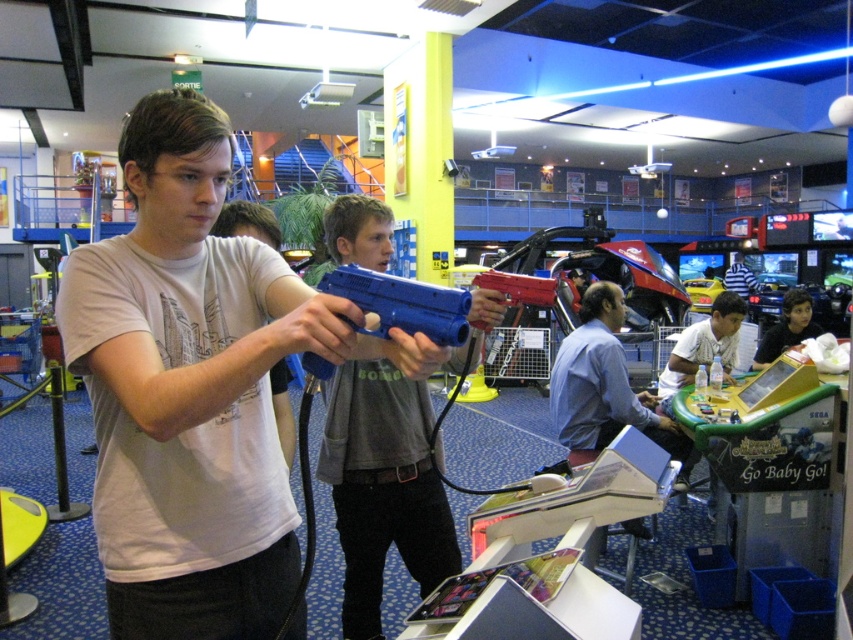
You are standing in the arcade and want to place a small decoration between the two points, point [664,444] and point [807,324]. To ensure it stays visible, should you place it closer to which point?

Place the decoration closer to point [664,444] because it is closer to the camera than point [807,324], ensuring better visibility.

You are a game attendant in the arcade. You need to place the blue plastic water gun at center into a storage box that can only hold items narrower than the dark blue shirt at center. Can the water gun fit?

The blue plastic water gun at center is narrower than the dark blue shirt at center, so it can fit into the storage box designed for items narrower than the dark blue shirt at center.